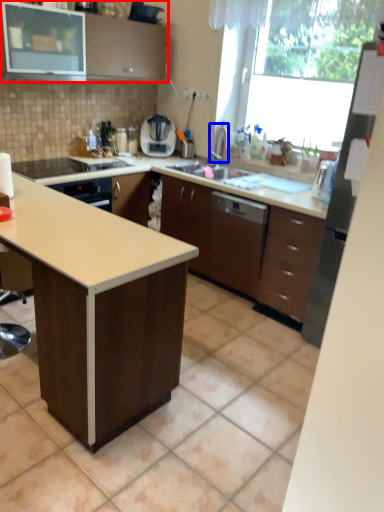
Question: Which of the following is the closest to the observer, cabinetry (highlighted by a red box) or faucet (highlighted by a blue box)?

Choices:
 (A) cabinetry
 (B) faucet

Answer: (A)